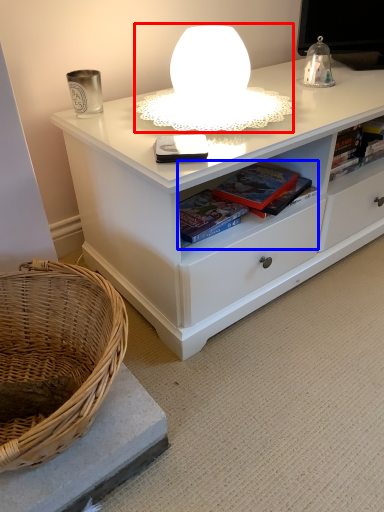
Question: Among these objects, which one is nearest to the camera, table lamp (highlighted by a red box) or book (highlighted by a blue box)?

Choices:
 (A) table lamp
 (B) book

Answer: (A)